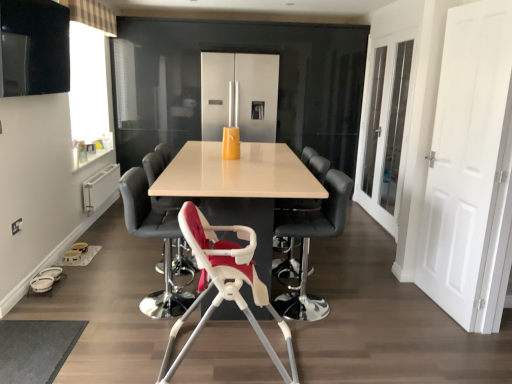
Locate an element on the screen. free space to the back side of white matte door at right is located at coordinates (394, 279).